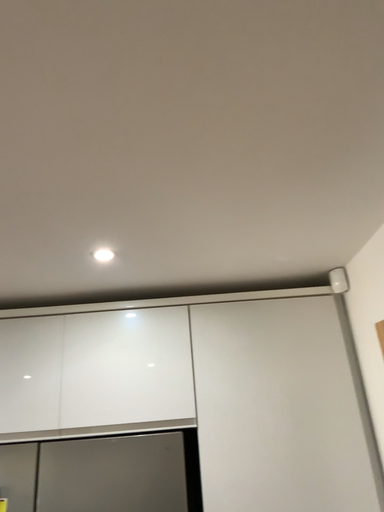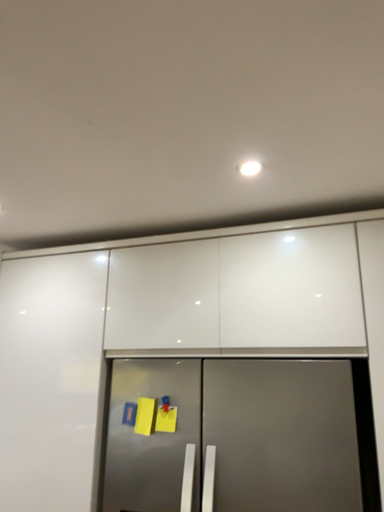
Question: How did the camera likely rotate when shooting the video?

Choices:
 (A) rotated upward
 (B) rotated downward

Answer: (B)